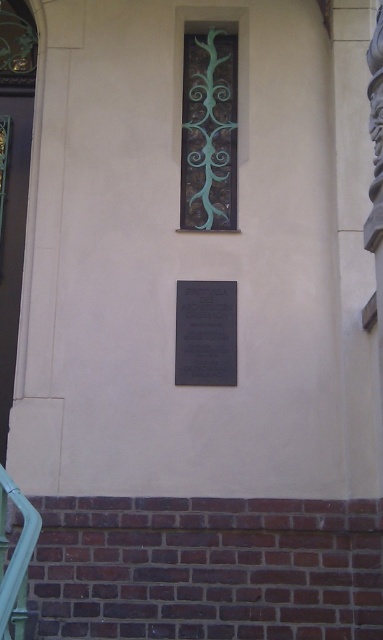
Based on the photo, can you confirm if green glass window at center is bigger than black polished stone plaque at center?

Indeed, green glass window at center has a larger size compared to black polished stone plaque at center.

Is green glass window at center smaller than black polished stone plaque at center?

→ No, green glass window at center is not smaller than black polished stone plaque at center.

Which is in front, point (214, 64) or point (211, 378)?

Point (211, 378) is more forward.

The height and width of the screenshot is (640, 383). I want to click on green glass window at center, so click(209, 131).

Is green glass window at center to the left of green matte rail at lower left from the viewer's perspective?

In fact, green glass window at center is to the right of green matte rail at lower left.

Image resolution: width=383 pixels, height=640 pixels. In order to click on green glass window at center in this screenshot , I will do `click(209, 131)`.

Between black polished stone plaque at center and green matte rail at lower left, which one appears on the left side from the viewer's perspective?

Positioned to the left is green matte rail at lower left.

Who is more distant from viewer, [227,353] or [26,538]?

Point [227,353]

The image size is (383, 640). What do you see at coordinates (206, 333) in the screenshot?
I see `black polished stone plaque at center` at bounding box center [206, 333].

Identify the location of black polished stone plaque at center. Image resolution: width=383 pixels, height=640 pixels. (206, 333).